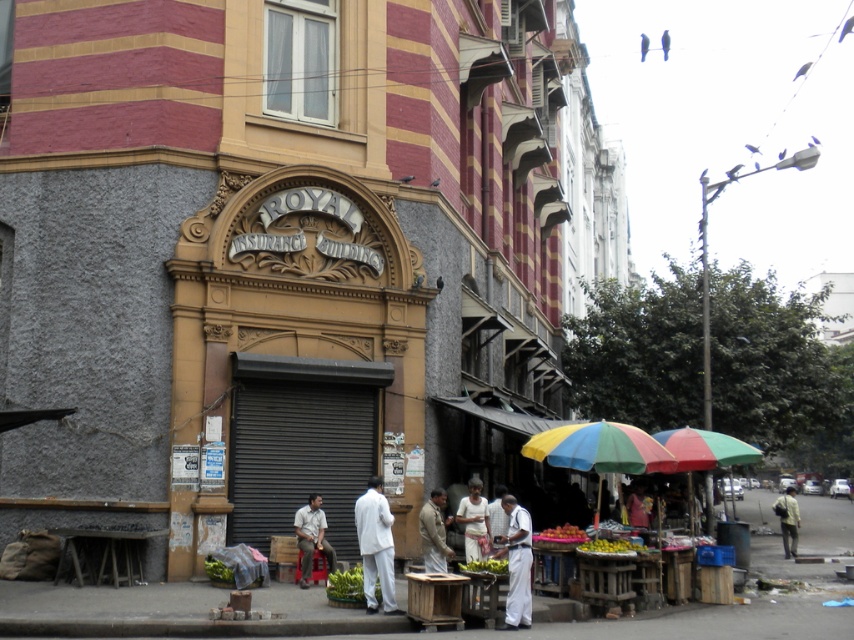
Question: Is metallic gray rolling shutter at center to the left of shiny red apples at lower center from the viewer's perspective?

Choices:
 (A) no
 (B) yes

Answer: (B)

Question: Is light beige fabric pants at lower center behind shiny red apples at lower center?

Choices:
 (A) yes
 (B) no

Answer: (B)

Question: Based on their relative distances, which object is farther from the shiny red apples at lower center?

Choices:
 (A) white matte coat at center
 (B) light brown leather jacket at center
 (C) green leafy vegetables at center

Answer: (B)

Question: Which point is closer to the camera?

Choices:
 (A) light brown leather jacket at center
 (B) yellow matte fruit at lower center
 (C) multicolored fabric umbrella at lower right

Answer: (B)

Question: Which of these objects is positioned farthest from the shiny red apples at lower center?

Choices:
 (A) light beige fabric pants at lower center
 (B) yellow matte fruit at lower center
 (C) white matte coat at center

Answer: (C)

Question: Is white matte coat at center closer to camera compared to light brown leather jacket at center?

Choices:
 (A) yes
 (B) no

Answer: (A)